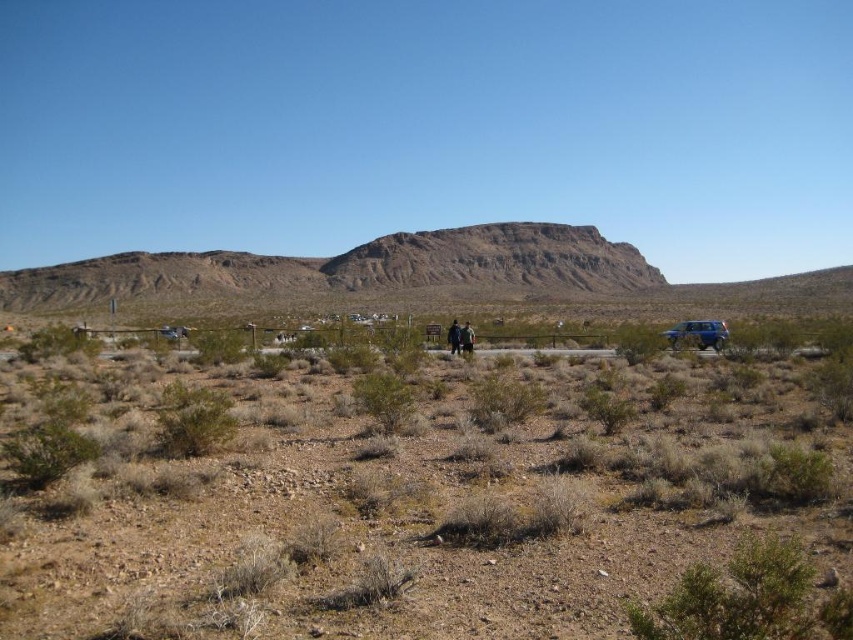
You are a hiker who wants to reach the blue metallic jeep at lower right from the brown sandy dirt field at center. Which direction should you move relative to the jeep?

The brown sandy dirt field at center is to the left of the blue metallic jeep at lower right, so to reach the jeep from the dirt field, you should move to the right.

You are taking a photo of the desert landscape and want to focus on both the point at coordinates point (158,499) and point (460,336). Which point should you adjust your focus to first to ensure it appears sharp in the image?

Point (158,499) is closer to the camera than point (460,336), so you should focus on point (158,499) first to ensure it appears sharp in the image.

You are standing at the point labeled as point (x=426, y=499) in the image. Based on the scene description, what type of terrain are you currently standing on?

The point (x=426, y=499) indicates a brown sandy dirt field at center, so you are standing on a sandy dirt field.